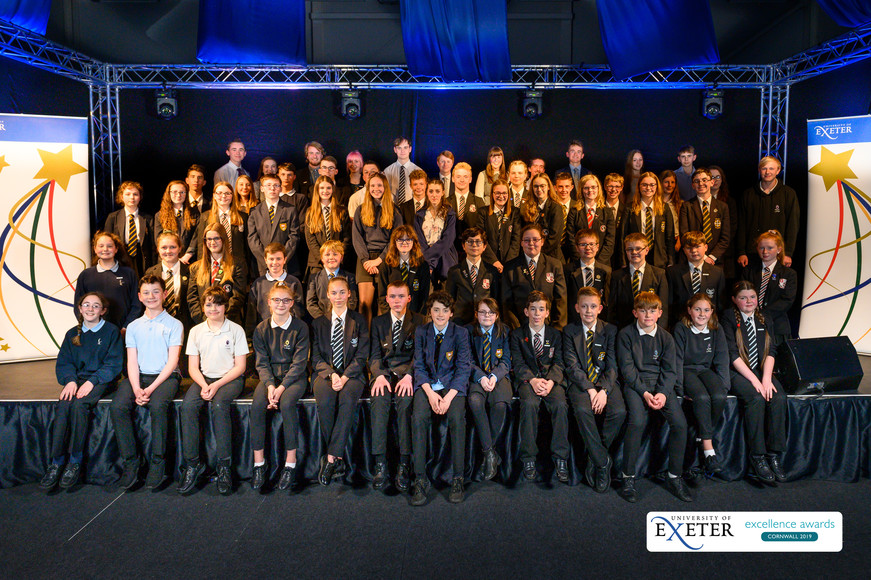
The height and width of the screenshot is (580, 871). I want to click on spotlights, so click(167, 105), click(347, 104), click(530, 102), click(725, 103).